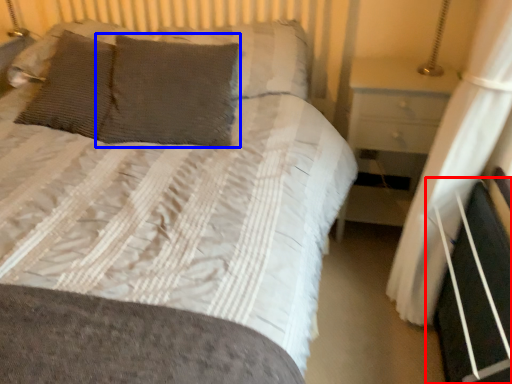
Question: Which object is closer to the camera taking this photo, bed frame (highlighted by a red box) or pillow (highlighted by a blue box)?

Choices:
 (A) bed frame
 (B) pillow

Answer: (A)